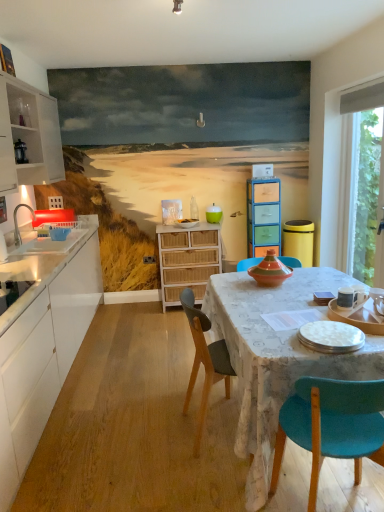
Question: Is white wood cabinet at left, the first cabinetry when ordered from left to right, wider or thinner than teal fabric chair at lower right, marked as the first chair in a front-to-back arrangement?

Choices:
 (A) wide
 (B) thin

Answer: (B)

Question: Is white wood cabinet at left, the 3th cabinetry viewed from the right, spatially inside teal fabric chair at lower right, which appears as the 2th chair when viewed from the left, or outside of it?

Choices:
 (A) outside
 (B) inside

Answer: (A)

Question: Based on their relative distances, which object is nearer to the white wood cabinet at left, the first cabinetry when ordered from left to right?

Choices:
 (A) white glossy plate at lower right, marked as the first tableware in a bottom-to-top arrangement
 (B) white matte cabinet at left, positioned as the second cabinetry in left-to-right order
 (C) multicolored wood cabinet at center, acting as the third cabinetry starting from the left
 (D) transparent glass window at right
 (E) teal fabric chair at lower right, which appears as the 2th chair when viewed from the left

Answer: (B)

Question: Based on their relative distances, which object is nearer to the textured fabric tablecloth at center?

Choices:
 (A) teal matte cup at center
 (B) white glossy plate at lower right, the third tableware positioned from the back
 (C) teal fabric chair at lower right, which appears as the 2th chair when viewed from the left
 (D) transparent glass window at right
 (E) white matte cabinet at left, positioned as the second cabinetry in right-to-left order

Answer: (C)